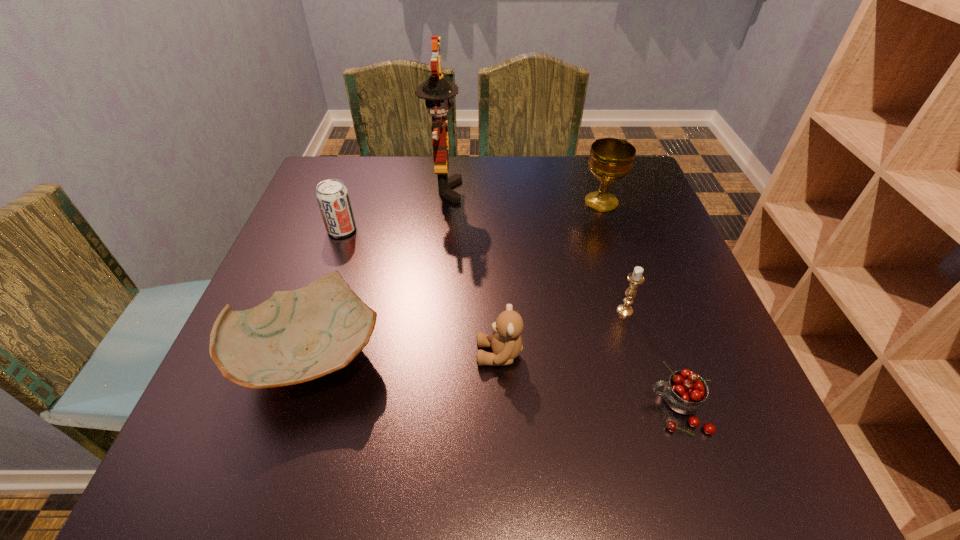
This screenshot has width=960, height=540. I want to click on vacant space situated on the front of the soda can, so click(x=324, y=278).

Where is `vacant region located on the front of the candle holder`? This screenshot has width=960, height=540. vacant region located on the front of the candle holder is located at coordinates (641, 364).

This screenshot has height=540, width=960. I want to click on vacant space located 0.090m on the front-facing side of the teddy bear, so click(x=427, y=355).

This screenshot has height=540, width=960. Find the location of `vacant area located 0.110m on the front-facing side of the teddy bear`. vacant area located 0.110m on the front-facing side of the teddy bear is located at coordinates (416, 355).

Image resolution: width=960 pixels, height=540 pixels. I want to click on vacant position located 0.390m on the front-facing side of the teddy bear, so click(262, 355).

Where is `free region located on the right of the pottery`? This screenshot has height=540, width=960. free region located on the right of the pottery is located at coordinates (599, 354).

What are the coordinates of `free region located on the handle side of the cherry` in the screenshot? It's located at click(594, 409).

I want to click on free space located on the handle side of the cherry, so click(576, 409).

Locate an element on the screen. The height and width of the screenshot is (540, 960). free space located 0.310m on the handle side of the cherry is located at coordinates (461, 409).

At what (x,y) coordinates should I click in order to perform the action: click on nutcracker positioned at the far edge. Please return your answer as a coordinate pair (x, y). This screenshot has height=540, width=960. Looking at the image, I should click on (437, 91).